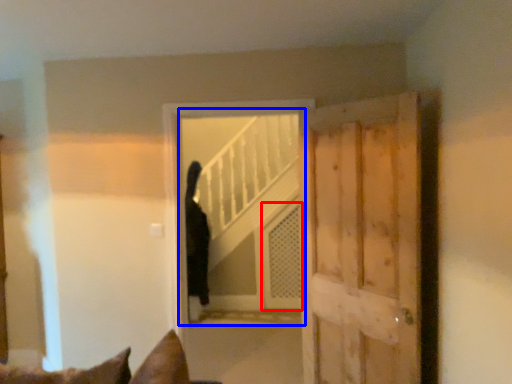
Question: Among these objects, which one is nearest to the camera, screen door (highlighted by a red box) or elevator (highlighted by a blue box)?

Choices:
 (A) screen door
 (B) elevator

Answer: (B)